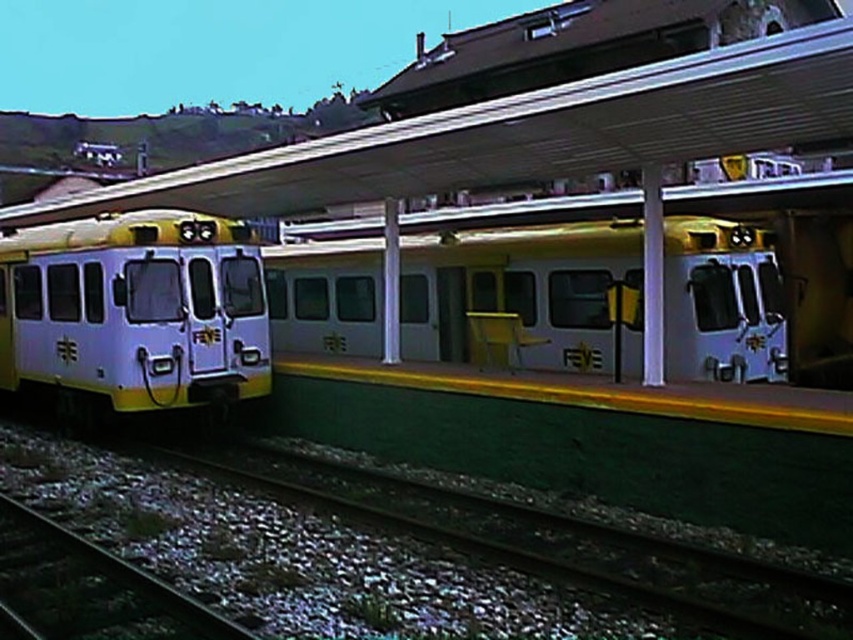
You are a passenger waiting at the train station. You see the white glossy train at center and the green gravel at lower left. Which object is closer to you as you stand on the platform?

The white glossy train at center is closer to you than the green gravel at lower left because the green gravel at lower left is behind the white glossy train at center.

You are standing on the platform and want to board the white matte train at center. The dark gray metal train track at lower left is where the train will stop. Can you safely walk from your current position to the train without stepping onto the track?

The white matte train at center is further to the viewer than the dark gray metal train track at lower left, meaning the track is behind the train. Since the train is already positioned in front of the track, you can safely walk to it without stepping onto the track.

From the picture: You are a passenger waiting at the train station. You notice the white glossy train at center and the green gravel at lower left. Which object takes up more space in the scene?

The white glossy train at center is larger in size than the green gravel at lower left, so it takes up more space in the scene.